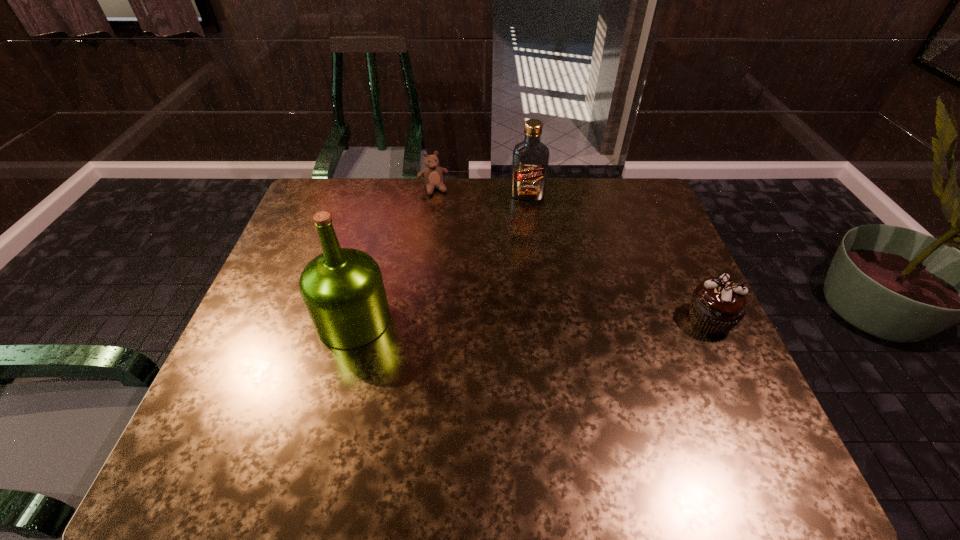
Locate an element on the screen. Image resolution: width=960 pixels, height=540 pixels. vacant space on the desktop that is between the olive oil and the rightmost object and is positioned on the front-facing side of the teddy bear is located at coordinates (490, 320).

In order to click on free spot on the desktop that is between the tallest object and the cupcake and is positioned on the front-facing side of the vodka in this screenshot , I will do `click(522, 320)`.